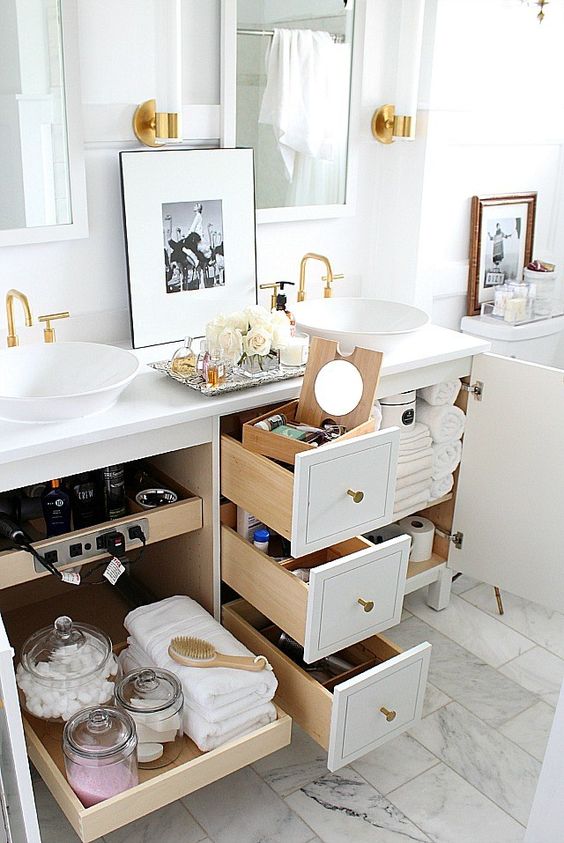
Find the location of a particular element. framed picture is located at coordinates [x=188, y=215], [x=504, y=224].